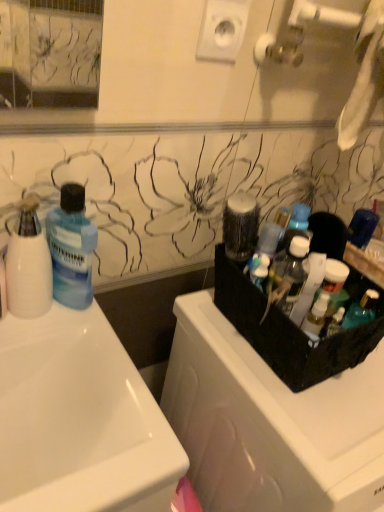
Image resolution: width=384 pixels, height=512 pixels. What do you see at coordinates (28, 265) in the screenshot?
I see `white matte cup at left, the 1th cleaning product in the left-to-right sequence` at bounding box center [28, 265].

Identify the location of translucent plastic container at upper right. (296, 226).

The width and height of the screenshot is (384, 512). Describe the element at coordinates (270, 423) in the screenshot. I see `black plastic dish washer at right` at that location.

Find the location of a particular element. white glossy sink at left is located at coordinates (79, 420).

This screenshot has height=512, width=384. What do you see at coordinates (71, 248) in the screenshot? I see `blue translucent liquid at left` at bounding box center [71, 248].

In order to face translucent plastic bottles at right, which appears as the 2th cleaning product when viewed from the left, should I rotate leftwards or rightwards?

Turn right by 15.493 degrees to look at translucent plastic bottles at right, which appears as the 2th cleaning product when viewed from the left.

Identify the location of white matte cup at left, the 1th cleaning product in the left-to-right sequence. (28, 265).

Who is smaller, white matte cup at left, which is the 2th cleaning product in right-to-left order, or translucent plastic bottles at right, placed as the 1th cleaning product when sorted from right to left?

translucent plastic bottles at right, placed as the 1th cleaning product when sorted from right to left.

From a real-world perspective, who is located higher, white matte cup at left, the 1th cleaning product in the left-to-right sequence, or translucent plastic bottles at right, which appears as the 2th cleaning product when viewed from the left?

In real-world perspective, translucent plastic bottles at right, which appears as the 2th cleaning product when viewed from the left, is above.

Is white matte cup at left, which is the 2th cleaning product in right-to-left order, in contact with translucent plastic bottles at right, placed as the 1th cleaning product when sorted from right to left?

No, white matte cup at left, which is the 2th cleaning product in right-to-left order, is not next to translucent plastic bottles at right, placed as the 1th cleaning product when sorted from right to left.

Does white matte cup at left, which is the 2th cleaning product in right-to-left order, have a lesser height compared to translucent plastic bottles at right, which appears as the 2th cleaning product when viewed from the left?

In fact, white matte cup at left, which is the 2th cleaning product in right-to-left order, may be taller than translucent plastic bottles at right, which appears as the 2th cleaning product when viewed from the left.

In the image, is translucent plastic container at upper right on the left side or the right side of white matte cup at left, which is the 2th cleaning product in right-to-left order?

From the image, it's evident that translucent plastic container at upper right is to the right of white matte cup at left, which is the 2th cleaning product in right-to-left order.

The height and width of the screenshot is (512, 384). Identify the location of toiletry that is on the right side of white matte cup at left, which is the 2th cleaning product in right-to-left order. (296, 226).

Can you confirm if translucent plastic container at upper right is bigger than white matte cup at left, which is the 2th cleaning product in right-to-left order?

Actually, translucent plastic container at upper right might be smaller than white matte cup at left, which is the 2th cleaning product in right-to-left order.

In the image, is white matte cup at left, the 1th cleaning product in the left-to-right sequence, on the left side or the right side of black plastic dish washer at right?

white matte cup at left, the 1th cleaning product in the left-to-right sequence, is to the left of black plastic dish washer at right.

Measure the distance between white matte cup at left, which is the 2th cleaning product in right-to-left order, and black plastic dish washer at right.

They are 15.94 inches apart.

Considering the sizes of objects white matte cup at left, which is the 2th cleaning product in right-to-left order, and black plastic dish washer at right in the image provided, who is thinner, white matte cup at left, which is the 2th cleaning product in right-to-left order, or black plastic dish washer at right?

Thinner between the two is white matte cup at left, which is the 2th cleaning product in right-to-left order.

Is white matte cup at left, the 1th cleaning product in the left-to-right sequence, positioned in front of black plastic dish washer at right?

No, the depth of white matte cup at left, the 1th cleaning product in the left-to-right sequence, is greater than that of black plastic dish washer at right.

Which object is further away from the camera, black plastic dish washer at right or white matte cup at left, which is the 2th cleaning product in right-to-left order?

white matte cup at left, which is the 2th cleaning product in right-to-left order.

Can you confirm if black plastic dish washer at right is taller than white matte cup at left, which is the 2th cleaning product in right-to-left order?

Yes.

Which object is thinner, black plastic dish washer at right or white matte cup at left, which is the 2th cleaning product in right-to-left order?

white matte cup at left, which is the 2th cleaning product in right-to-left order.

Is black plastic dish washer at right to the left of white matte cup at left, which is the 2th cleaning product in right-to-left order, from the viewer's perspective?

No, black plastic dish washer at right is not to the left of white matte cup at left, which is the 2th cleaning product in right-to-left order.

Is white glossy sink at left to the right of translucent plastic bottles at right, which appears as the 2th cleaning product when viewed from the left, from the viewer's perspective?

No, white glossy sink at left is not to the right of translucent plastic bottles at right, which appears as the 2th cleaning product when viewed from the left.

Does white glossy sink at left have a larger size compared to translucent plastic bottles at right, placed as the 1th cleaning product when sorted from right to left?

Indeed, white glossy sink at left has a larger size compared to translucent plastic bottles at right, placed as the 1th cleaning product when sorted from right to left.

Are white glossy sink at left and translucent plastic bottles at right, placed as the 1th cleaning product when sorted from right to left, making contact?

white glossy sink at left is not next to translucent plastic bottles at right, placed as the 1th cleaning product when sorted from right to left, and they're not touching.

How much distance is there between white glossy sink at left and translucent plastic bottles at right, which appears as the 2th cleaning product when viewed from the left?

white glossy sink at left and translucent plastic bottles at right, which appears as the 2th cleaning product when viewed from the left, are 38.76 centimeters apart from each other.

Considering the sizes of objects white matte cup at left, which is the 2th cleaning product in right-to-left order, and blue translucent liquid at left in the image provided, who is wider, white matte cup at left, which is the 2th cleaning product in right-to-left order, or blue translucent liquid at left?

blue translucent liquid at left.

Is white matte cup at left, the 1th cleaning product in the left-to-right sequence, to the left of blue translucent liquid at left from the viewer's perspective?

Indeed, white matte cup at left, the 1th cleaning product in the left-to-right sequence, is positioned on the left side of blue translucent liquid at left.

Which object is further away from the camera, white matte cup at left, which is the 2th cleaning product in right-to-left order, or blue translucent liquid at left?

blue translucent liquid at left is behind.

What's the angular difference between white matte cup at left, the 1th cleaning product in the left-to-right sequence, and blue translucent liquid at left's facing directions?

0.00238 degrees.

Is blue translucent liquid at left positioned far away from translucent plastic container at upper right?

No, blue translucent liquid at left is not far away from translucent plastic container at upper right.

Is blue translucent liquid at left to the left or to the right of translucent plastic container at upper right in the image?

blue translucent liquid at left is to the left of translucent plastic container at upper right.

Considering the positions of points (54, 281) and (298, 226), is point (54, 281) closer to camera compared to point (298, 226)?

That is False.

How much distance is there between blue translucent liquid at left and translucent plastic container at upper right?

blue translucent liquid at left is 13.94 inches away from translucent plastic container at upper right.

The height and width of the screenshot is (512, 384). In order to click on cleaning product located below the white matte cup at left, which is the 2th cleaning product in right-to-left order (from the image's perspective) in this screenshot , I will do `click(309, 286)`.

There is a translucent plastic container at upper right. Identify the location of the 2nd cleaning product below it (from a real-world perspective). (28, 265).

Estimate the real-world distances between objects in this image. Which object is closer to translucent plastic container at upper right, translucent plastic bottles at right, which appears as the 2th cleaning product when viewed from the left, or black plastic dish washer at right?

translucent plastic bottles at right, which appears as the 2th cleaning product when viewed from the left, lies closer to translucent plastic container at upper right than the other object.

When comparing their distances from white glossy sink at left, does black plastic dish washer at right or blue translucent liquid at left seem further?

Among the two, black plastic dish washer at right is located further to white glossy sink at left.

Looking at the image, which one is located closer to translucent plastic bottles at right, placed as the 1th cleaning product when sorted from right to left, translucent plastic container at upper right or black plastic dish washer at right?

translucent plastic container at upper right is closer to translucent plastic bottles at right, placed as the 1th cleaning product when sorted from right to left.

From the image, which object appears to be farther from blue translucent liquid at left, translucent plastic container at upper right or translucent plastic bottles at right, which appears as the 2th cleaning product when viewed from the left?

translucent plastic bottles at right, which appears as the 2th cleaning product when viewed from the left.

When comparing their distances from translucent plastic container at upper right, does blue translucent liquid at left or translucent plastic bottles at right, which appears as the 2th cleaning product when viewed from the left, seem further?

The object further to translucent plastic container at upper right is blue translucent liquid at left.

From the image, which object appears to be nearer to white matte cup at left, the 1th cleaning product in the left-to-right sequence, translucent plastic container at upper right or black plastic dish washer at right?

black plastic dish washer at right lies closer to white matte cup at left, the 1th cleaning product in the left-to-right sequence, than the other object.

From the image, which object appears to be nearer to black plastic dish washer at right, white glossy sink at left or blue translucent liquid at left?

Based on the image, white glossy sink at left appears to be nearer to black plastic dish washer at right.

Looking at this image, when comparing their distances from white matte cup at left, which is the 2th cleaning product in right-to-left order, does blue translucent liquid at left or black plastic dish washer at right seem closer?

Based on the image, blue translucent liquid at left appears to be nearer to white matte cup at left, which is the 2th cleaning product in right-to-left order.

You are a GUI agent. You are given a task and a screenshot of the screen. Output one action in this format:
    pyautogui.click(x=<x>, y=<y>)
    Task: Click on the bottle between white glossy sink at left and translucent plastic bottles at right, placed as the 1th cleaning product when sorted from right to left, from left to right
    The height and width of the screenshot is (512, 384).
    Given the screenshot: What is the action you would take?
    pyautogui.click(x=71, y=248)

Locate an element on the screen. The height and width of the screenshot is (512, 384). bottle between white matte cup at left, which is the 2th cleaning product in right-to-left order, and translucent plastic bottles at right, which appears as the 2th cleaning product when viewed from the left, from left to right is located at coordinates (71, 248).

You are a GUI agent. You are given a task and a screenshot of the screen. Output one action in this format:
    pyautogui.click(x=<x>, y=<y>)
    Task: Click on the bottle between white matte cup at left, the 1th cleaning product in the left-to-right sequence, and translucent plastic container at upper right
    This screenshot has width=384, height=512.
    Given the screenshot: What is the action you would take?
    pyautogui.click(x=71, y=248)

Where is `toiletry located between blue translucent liquid at left and translucent plastic bottles at right, which appears as the 2th cleaning product when viewed from the left, in the left-right direction`? This screenshot has height=512, width=384. toiletry located between blue translucent liquid at left and translucent plastic bottles at right, which appears as the 2th cleaning product when viewed from the left, in the left-right direction is located at coordinates (296, 226).